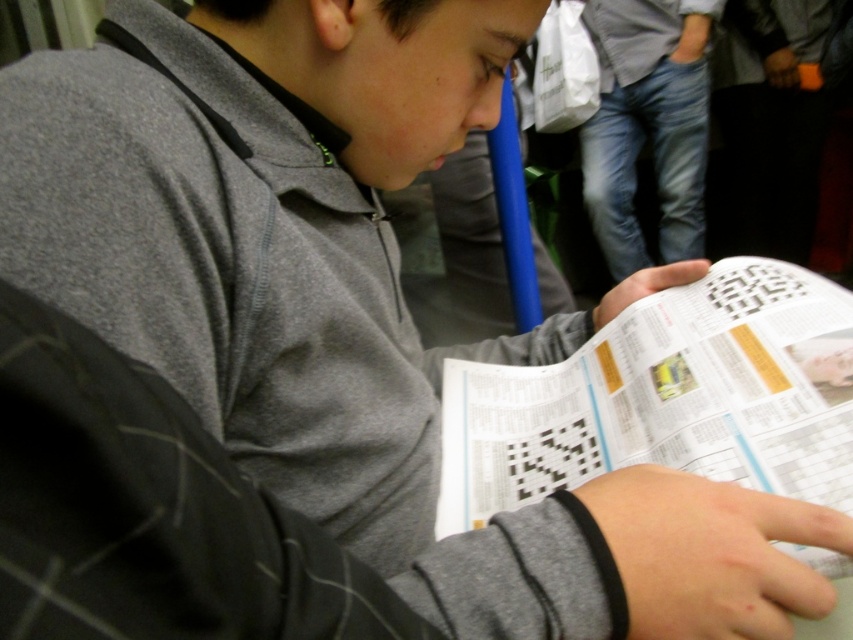
Based on the photo, you are designing a layout for a magazine spread. You need to place an image of the white paper at center and the jeans at right in such a way that their sizes are proportionate to the original scene. Which object should you make larger in the magazine layout?

The jeans at right should be made larger in the magazine layout because the white paper at center is smaller than the jeans at right in the original scene.

From the picture: You are a passenger on a train and see the white paper at center and the jeans at right. Which object is closer to the left side of the train seat?

The white paper at center is closer to the left side of the train seat because it is positioned to the left of the jeans at right.